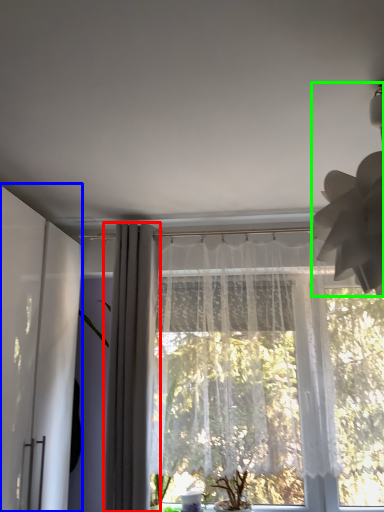
Question: Based on their relative distances, which object is farther from curtain (highlighted by a red box)? Choose from screen door (highlighted by a blue box) and lamp (highlighted by a green box).

Choices:
 (A) screen door
 (B) lamp

Answer: (B)